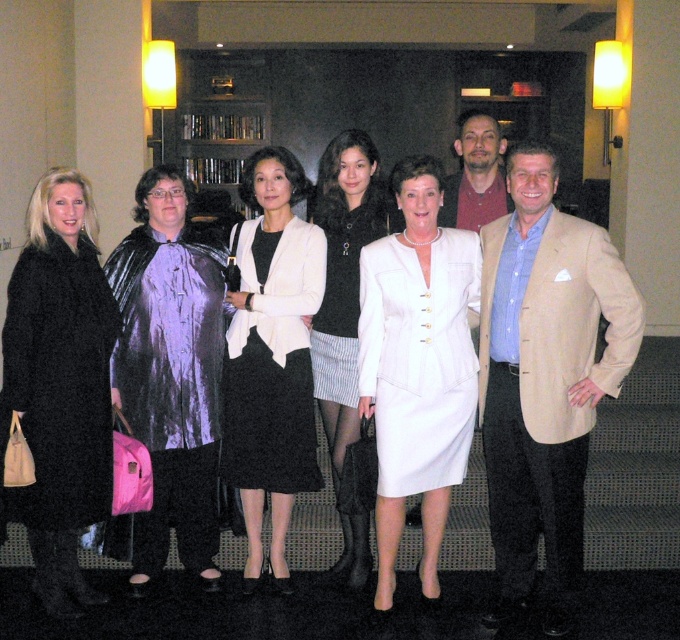
Which object is located at the coordinates point (272, 355)?

The point at (272, 355) marks the matte white blazer at center.

You are standing in the room and see the point at coordinates (539, 289). You want to place a 3.5 meter long banner horizontally from this point to the wall behind the group. Is there enough space?

The distance from the point at coordinates (539, 289) to the viewer is 3.63 meters. Since the banner is 3.5 meters long, there is enough space to place it horizontally from that point to the wall behind the group.

You are a photographer arranging a group photo. You need to ensure that the white satin dress at center and the matte brown jacket at center do not overlap in the final shot. Based on their sizes, which one should you position slightly to the side to prevent overlap?

The white satin dress at center is wider than the matte brown jacket at center, so you should position the white satin dress at center slightly to the side to prevent overlap.